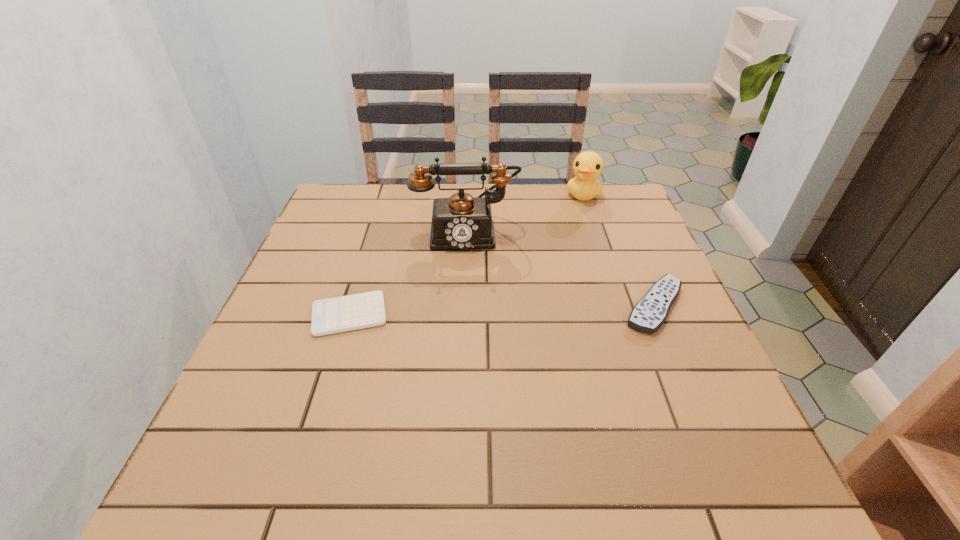
This screenshot has width=960, height=540. I want to click on empty space between the calculator and the third tallest object, so click(x=502, y=310).

Find the location of a particular element. free space that is in between the third tallest object and the farthest object is located at coordinates (618, 250).

Where is `free space between the tallest object and the duck`? free space between the tallest object and the duck is located at coordinates (525, 214).

Locate an element on the screen. The width and height of the screenshot is (960, 540). blank region between the shortest object and the third nearest object is located at coordinates (408, 274).

Where is `vacant area between the second object from left to right and the duck`? The height and width of the screenshot is (540, 960). vacant area between the second object from left to right and the duck is located at coordinates 525,214.

This screenshot has height=540, width=960. I want to click on free space between the calculator and the second shortest object, so click(x=502, y=310).

What are the coordinates of `vacant area between the duck and the leftmost object` in the screenshot? It's located at (467, 255).

Locate which object ranks second in proximity to the remote control. Please provide its 2D coordinates. Your answer should be formatted as a tuple, i.e. [(x, y)], where the tuple contains the x and y coordinates of a point satisfying the conditions above.

[(587, 166)]

The width and height of the screenshot is (960, 540). I want to click on the closest object relative to the shortest object, so click(x=461, y=222).

Where is `free location that satisfies the following two spatial constraints: 1. on the front side of the second object from left to right; 2. on the left side of the third tallest object`? The width and height of the screenshot is (960, 540). free location that satisfies the following two spatial constraints: 1. on the front side of the second object from left to right; 2. on the left side of the third tallest object is located at coordinates pos(464,306).